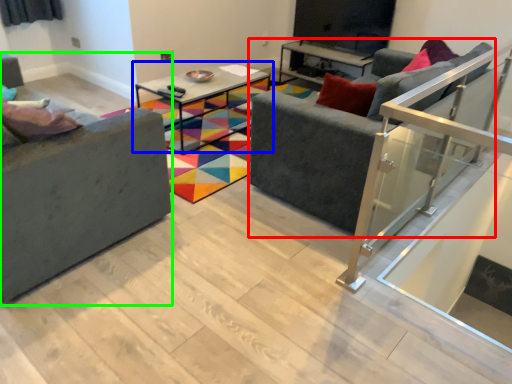
Question: Which object is positioned farthest from studio couch (highlighted by a red box)? Select from table (highlighted by a blue box) and studio couch (highlighted by a green box).

Choices:
 (A) table
 (B) studio couch

Answer: (A)